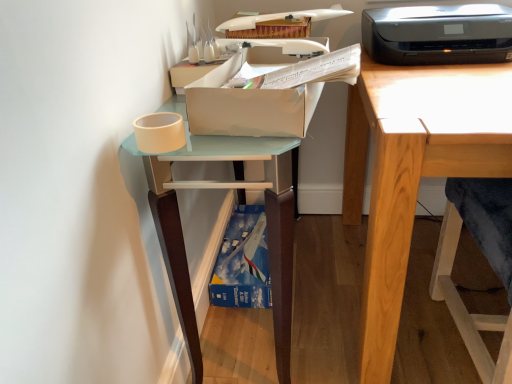
The width and height of the screenshot is (512, 384). In order to click on vacant space in front of black plastic printer at upper right in this screenshot , I will do `click(443, 84)`.